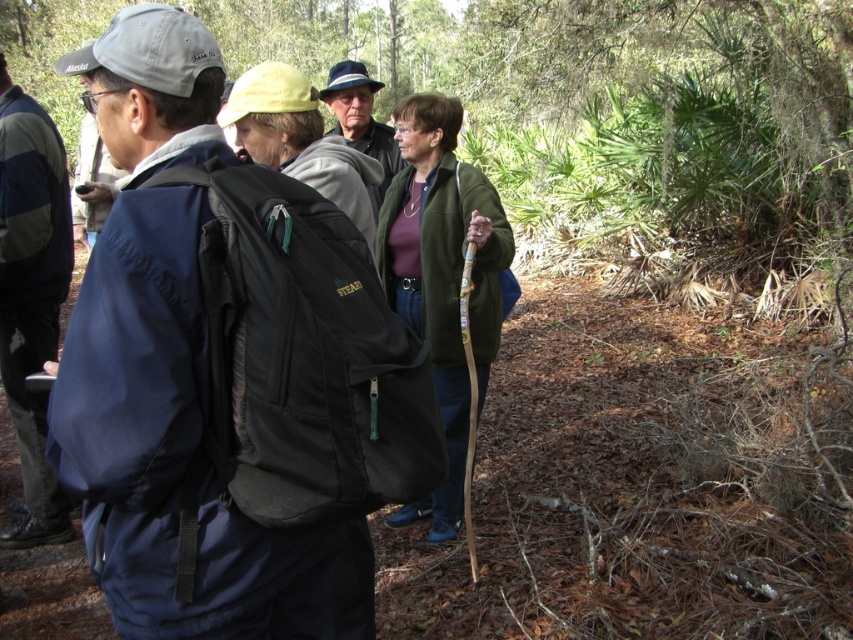
Does green woolen jacket at center appear on the right side of matte black hat at upper center?

Indeed, green woolen jacket at center is positioned on the right side of matte black hat at upper center.

Can you confirm if green woolen jacket at center is wider than matte black hat at upper center?

Yes, green woolen jacket at center is wider than matte black hat at upper center.

This screenshot has height=640, width=853. What do you see at coordinates (442, 276) in the screenshot? I see `green woolen jacket at center` at bounding box center [442, 276].

At what (x,y) coordinates should I click in order to perform the action: click on green woolen jacket at center. Please return your answer as a coordinate pair (x, y). The height and width of the screenshot is (640, 853). Looking at the image, I should click on (442, 276).

Is matte blue jacket at left below matte black hat at upper center?

Indeed, matte blue jacket at left is positioned under matte black hat at upper center.

Image resolution: width=853 pixels, height=640 pixels. Identify the location of matte blue jacket at left. (172, 374).

Is point (131, 241) positioned after point (51, 529)?

No, (131, 241) is closer to viewer.

Which of these two, matte blue jacket at left or dark blue fabric jacket at left, stands taller?

dark blue fabric jacket at left is taller.

In order to click on matte blue jacket at left in this screenshot , I will do `click(172, 374)`.